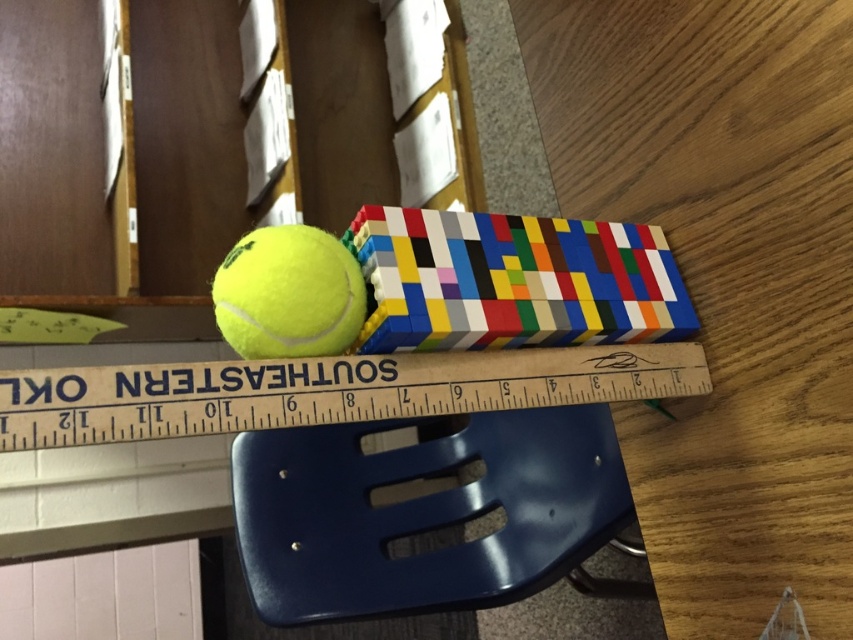
Question: Which of these objects is positioned farthest from the yellow matte tennis ball at center?

Choices:
 (A) wooden ruler at center
 (B) blue plastic chair at lower center

Answer: (B)

Question: Which object is the farthest from the yellow matte tennis ball at center?

Choices:
 (A) wooden ruler at center
 (B) blue plastic chair at lower center

Answer: (B)

Question: Is blue plastic chair at lower center in front of wooden ruler at center?

Choices:
 (A) no
 (B) yes

Answer: (A)

Question: Is blue plastic chair at lower center above yellow matte tennis ball at center?

Choices:
 (A) no
 (B) yes

Answer: (A)

Question: Considering the real-world distances, which object is farthest from the wooden ruler at center?

Choices:
 (A) yellow matte tennis ball at center
 (B) blue plastic chair at lower center

Answer: (B)

Question: Considering the relative positions of wooden ruler at center and yellow matte tennis ball at center in the image provided, where is wooden ruler at center located with respect to yellow matte tennis ball at center?

Choices:
 (A) right
 (B) left

Answer: (A)